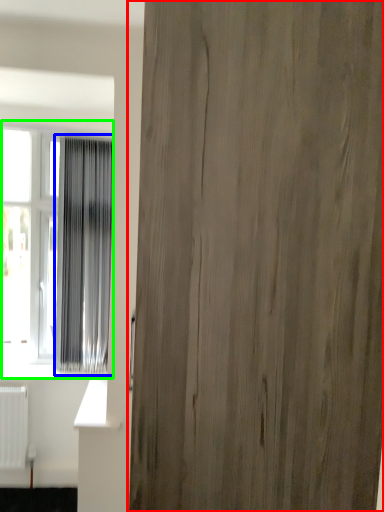
Question: Which is farther away from door (highlighted by a red box)? curtain (highlighted by a blue box) or window (highlighted by a green box)?

Choices:
 (A) curtain
 (B) window

Answer: (B)